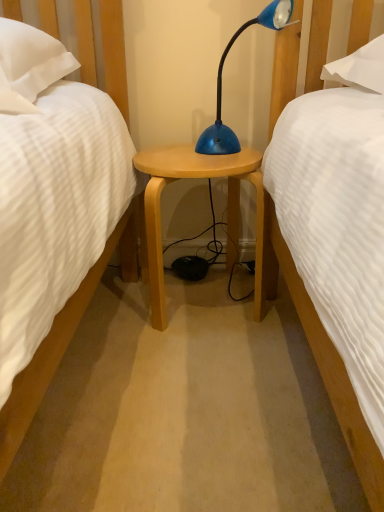
Question: Is blue plastic lamp at center located outside light wood/finishednightstand at center?

Choices:
 (A) yes
 (B) no

Answer: (A)

Question: Does blue plastic lamp at center have a greater width compared to light wood/finishednightstand at center?

Choices:
 (A) yes
 (B) no

Answer: (B)

Question: Is blue plastic lamp at center facing towards light wood/finishednightstand at center?

Choices:
 (A) yes
 (B) no

Answer: (B)

Question: From the image's perspective, is blue plastic lamp at center on top of light wood/finishednightstand at center?

Choices:
 (A) no
 (B) yes

Answer: (B)

Question: Is blue plastic lamp at center smaller than light wood/finishednightstand at center?

Choices:
 (A) no
 (B) yes

Answer: (B)

Question: Does blue plastic lamp at center lie behind light wood/finishednightstand at center?

Choices:
 (A) yes
 (B) no

Answer: (B)

Question: Can you confirm if light wood/finishednightstand at center is shorter than blue plastic lamp at center?

Choices:
 (A) no
 (B) yes

Answer: (A)

Question: Is light wood/finishednightstand at center not close to blue plastic lamp at center?

Choices:
 (A) no
 (B) yes

Answer: (A)

Question: Does light wood/finishednightstand at center have a greater width compared to blue plastic lamp at center?

Choices:
 (A) no
 (B) yes

Answer: (B)

Question: Is light wood/finishednightstand at center closer to camera compared to blue plastic lamp at center?

Choices:
 (A) yes
 (B) no

Answer: (B)

Question: From the image's perspective, is light wood/finishednightstand at center located beneath blue plastic lamp at center?

Choices:
 (A) yes
 (B) no

Answer: (A)

Question: From the image's perspective, is light wood/finishednightstand at center on top of blue plastic lamp at center?

Choices:
 (A) yes
 (B) no

Answer: (B)

Question: From the image's perspective, is blue plastic lamp at center positioned above or below light wood/finishednightstand at center?

Choices:
 (A) below
 (B) above

Answer: (B)